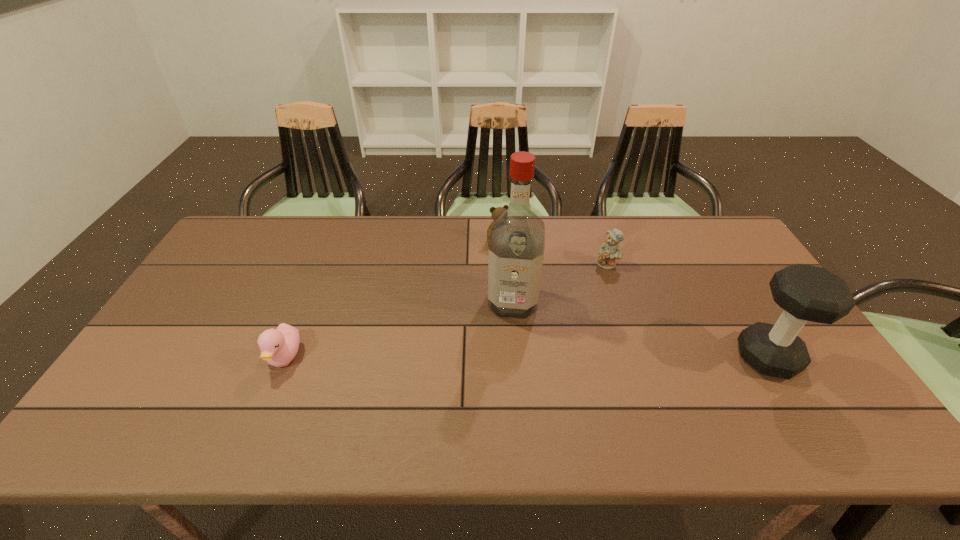
Image resolution: width=960 pixels, height=540 pixels. Identify the location of vacant region located 0.350m on the left of the dumbbell. (601, 357).

I want to click on vacant space located 0.160m on the front-facing side of the left teddy bear, so click(x=522, y=283).

Identify the location of vacant space located 0.100m on the front-facing side of the left teddy bear. (516, 271).

Find the location of a particular element. The width and height of the screenshot is (960, 540). free spot located on the front-facing side of the left teddy bear is located at coordinates (519, 277).

I want to click on vacant area situated 0.120m on the front-facing side of the right teddy bear, so click(599, 295).

You are a GUI agent. You are given a task and a screenshot of the screen. Output one action in this format:
    pyautogui.click(x=<x>, y=<y>)
    Task: Click on the free point located 0.150m on the front-facing side of the right teddy bear
    
    Given the screenshot: What is the action you would take?
    pyautogui.click(x=597, y=302)

Locate an element on the screen. The image size is (960, 540). vacant area located 0.310m on the front-facing side of the right teddy bear is located at coordinates (588, 342).

Where is `vacant space situated 0.090m on the front-facing side of the liquor`? vacant space situated 0.090m on the front-facing side of the liquor is located at coordinates (509, 346).

What are the coordinates of `free region located 0.190m on the front-facing side of the liquor` in the screenshot? It's located at (506, 377).

Locate an element on the screen. Image resolution: width=960 pixels, height=540 pixels. free space located 0.110m on the front-facing side of the liquor is located at coordinates (509, 352).